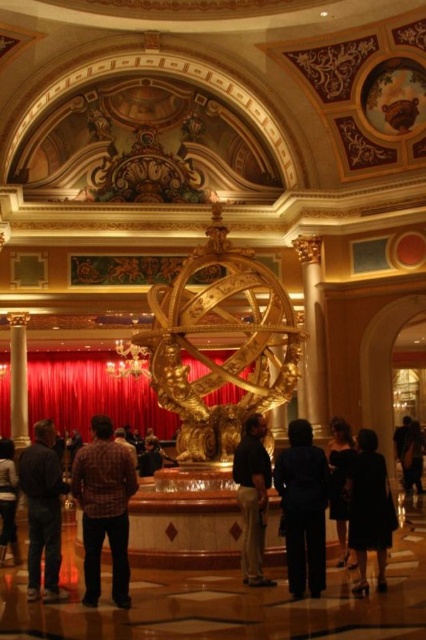
Does black fabric pants at center have a lesser width compared to dark gray shirt at lower left?

Yes, black fabric pants at center is thinner than dark gray shirt at lower left.

The image size is (426, 640). I want to click on black fabric pants at center, so click(302, 508).

You are a GUI agent. You are given a task and a screenshot of the screen. Output one action in this format:
    pyautogui.click(x=<x>, y=<y>)
    Task: Click on the black fabric pants at center
    
    Given the screenshot: What is the action you would take?
    point(302,508)

Who is positioned more to the left, black fabric pants at center or dark gray pants at lower left?

dark gray pants at lower left

Is black fabric pants at center closer to camera compared to dark gray pants at lower left?

Yes, it is in front of dark gray pants at lower left.

Describe the element at coordinates (302, 508) in the screenshot. This screenshot has height=640, width=426. I see `black fabric pants at center` at that location.

You are a GUI agent. You are given a task and a screenshot of the screen. Output one action in this format:
    pyautogui.click(x=<x>, y=<y>)
    Task: Click on the black fabric pants at center
    The height and width of the screenshot is (640, 426).
    Given the screenshot: What is the action you would take?
    pyautogui.click(x=302, y=508)

Find the location of a particular element. The height and width of the screenshot is (640, 426). dark gray pants at lower left is located at coordinates (43, 509).

Does dark gray pants at lower left appear under black silk dress at center?

No.

In order to click on dark gray pants at lower left in this screenshot , I will do click(43, 509).